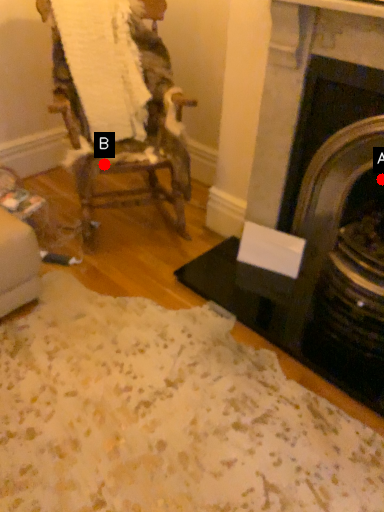
Question: Two points are circled on the image, labeled by A and B beside each circle. Which point is closer to the camera taking this photo?

Choices:
 (A) A is closer
 (B) B is closer

Answer: (A)